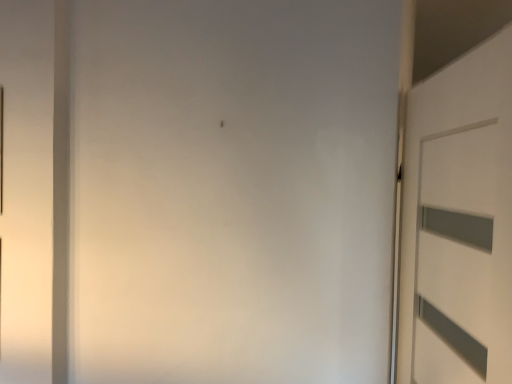
The image size is (512, 384). Identify the location of white matte door at right. (459, 221).

Describe the element at coordinates (459, 221) in the screenshot. I see `white matte door at right` at that location.

Where is `white matte door at right`? white matte door at right is located at coordinates (459, 221).